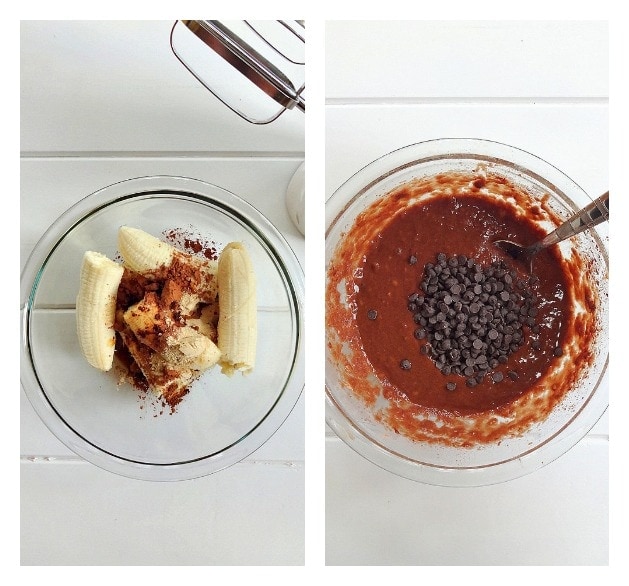
The width and height of the screenshot is (629, 586). I want to click on glass bowls, so click(x=187, y=435), click(x=398, y=462).